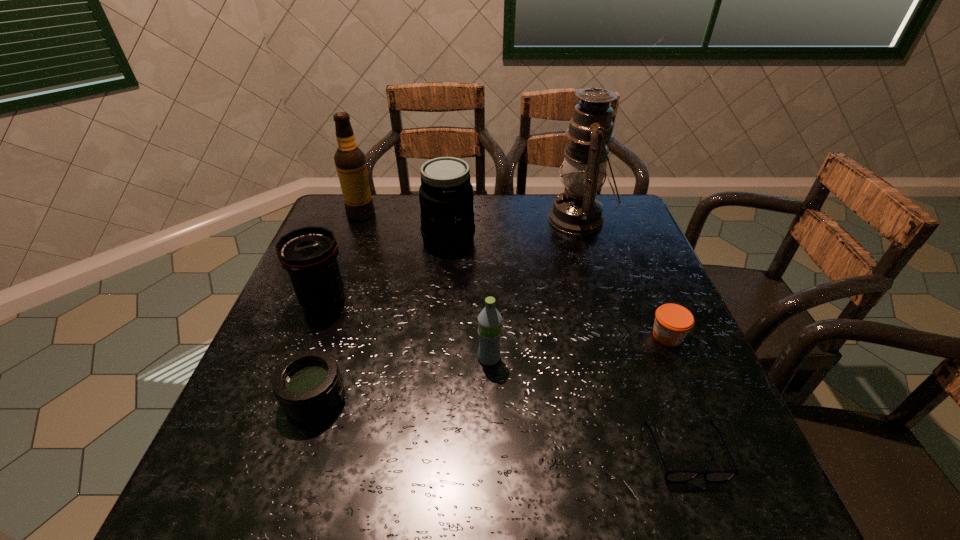
Find the location of a particular element. vacant region between the water bottle and the spectacles is located at coordinates (x=588, y=404).

Locate an element on the screen. This screenshot has width=960, height=540. vacant space in between the jam and the shortest telephoto lens is located at coordinates (492, 367).

This screenshot has width=960, height=540. I want to click on vacant region between the spectacles and the second shortest object, so click(677, 394).

The image size is (960, 540). I want to click on free space between the fourth farthest object and the third tallest object, so click(x=386, y=270).

Where is `unoccupied area between the oil lamp and the fifth nearest object`? The width and height of the screenshot is (960, 540). unoccupied area between the oil lamp and the fifth nearest object is located at coordinates (451, 260).

Where is `free space between the sixth shortest object and the alcohol`? This screenshot has width=960, height=540. free space between the sixth shortest object and the alcohol is located at coordinates (405, 227).

You are a GUI agent. You are given a task and a screenshot of the screen. Output one action in this format:
    pyautogui.click(x=<x>, y=<y>)
    Task: Click on the empty location between the shortest object and the tallest object
    The image size is (960, 540).
    Given the screenshot: What is the action you would take?
    pos(633,335)

Identify the location of object that is the fifth closest to the oil lamp. The height and width of the screenshot is (540, 960). (309, 254).

Find the location of a particular element. Image resolution: width=960 pixels, height=540 pixels. object that is the third closest to the alcohol is located at coordinates (577, 210).

This screenshot has height=540, width=960. I want to click on telephoto lens that is the closest to the second tallest telephoto lens, so click(308, 385).